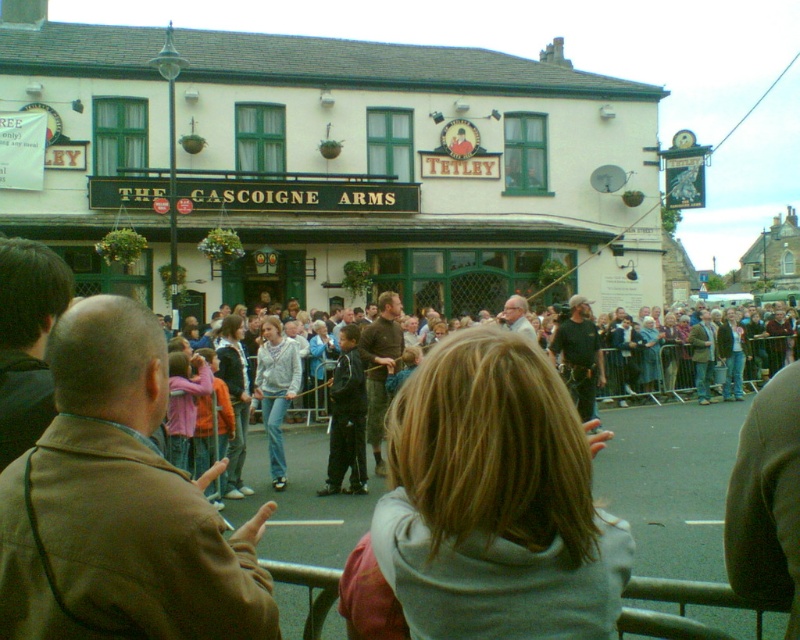
Question: Which point appears farthest from the camera in this image?

Choices:
 (A) (404, 324)
 (B) (410, 600)

Answer: (A)

Question: Among these points, which one is nearest to the camera?

Choices:
 (A) (604, 433)
 (B) (281, 387)

Answer: (A)

Question: Is light brown hair at center to the right of light gray hoodie at center from the viewer's perspective?

Choices:
 (A) yes
 (B) no

Answer: (B)

Question: Does light brown hair at center have a greater width compared to light gray hoodie at center?

Choices:
 (A) yes
 (B) no

Answer: (B)

Question: From the image, what is the correct spatial relationship of light brown hair at center in relation to light gray hoodie at center?

Choices:
 (A) right
 (B) left

Answer: (B)